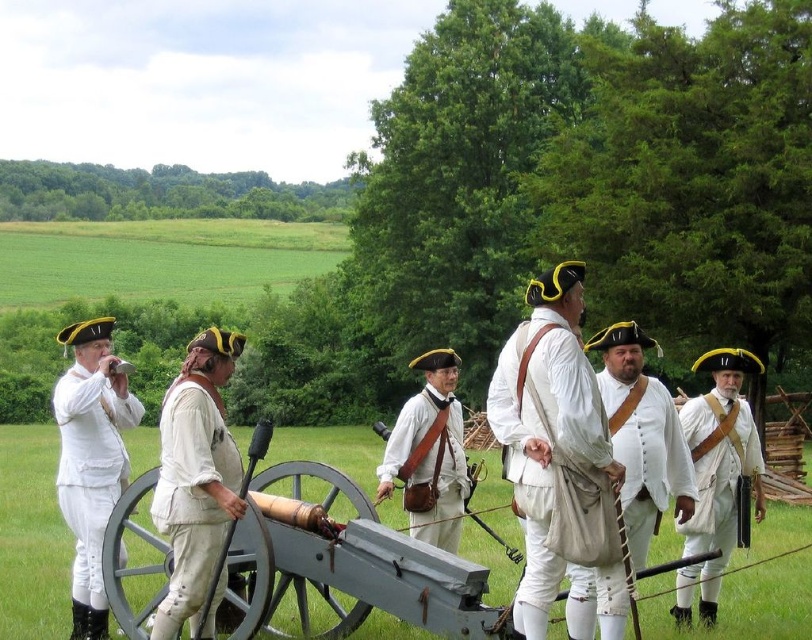
You are a photographer standing in the field. You want to take a photo that includes both the white cotton coat at center and the white matte uniform at left. Based on their positions, which one will appear higher in the photo?

The white cotton coat at center appears higher in the photo because it is positioned above the white matte uniform at left.

You are a photographer at the historical event. You want to capture a photo of the white cotton coat at center and the white cotton shirt at center. Which one is closer to the camera?

The white cotton coat at center is in front of the white cotton shirt at center, so the white cotton coat at center is closer to the camera.